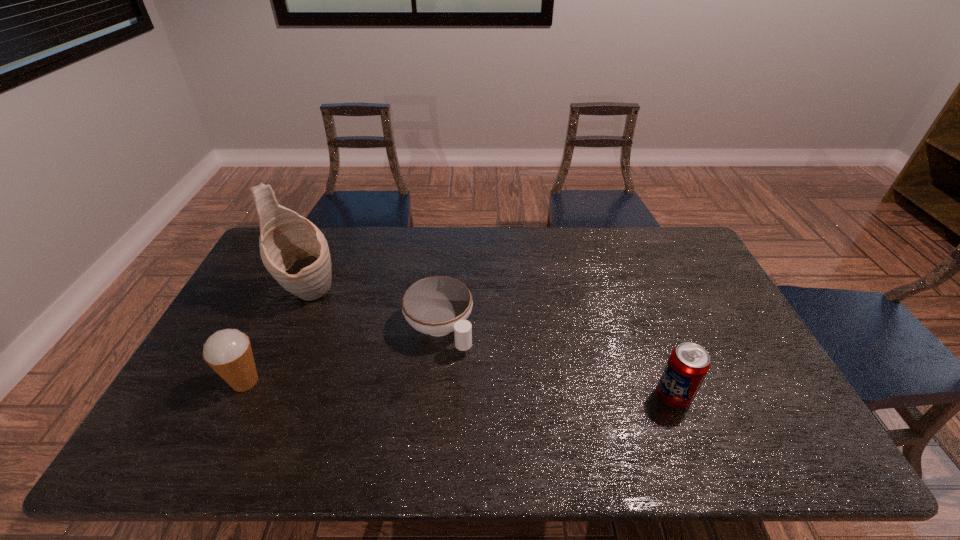
In the image, there is a desktop. Where is `vacant space at the right edge`? Image resolution: width=960 pixels, height=540 pixels. vacant space at the right edge is located at coordinates (728, 328).

Where is `free point between the rightmost object and the shortest object`? free point between the rightmost object and the shortest object is located at coordinates (556, 362).

You are a GUI agent. You are given a task and a screenshot of the screen. Output one action in this format:
    pyautogui.click(x=<x>, y=<y>)
    Task: Click on the vacant region between the icecream and the soda can
    The height and width of the screenshot is (540, 960).
    Given the screenshot: What is the action you would take?
    pyautogui.click(x=459, y=389)

You are a GUI agent. You are given a task and a screenshot of the screen. Output one action in this format:
    pyautogui.click(x=<x>, y=<y>)
    Task: Click on the free space that is in between the chinaware and the icecream
    The image size is (960, 540).
    Given the screenshot: What is the action you would take?
    pyautogui.click(x=342, y=355)

I want to click on free space between the chinaware and the tallest object, so click(373, 311).

Where is `free space between the shortest object and the pitcher`? free space between the shortest object and the pitcher is located at coordinates (373, 311).

The width and height of the screenshot is (960, 540). Identify the location of unoccupied position between the pitcher and the icecream. (276, 338).

The height and width of the screenshot is (540, 960). In order to click on vacant space that's between the rightmost object and the icecream in this screenshot , I will do `click(459, 389)`.

You are a GUI agent. You are given a task and a screenshot of the screen. Output one action in this format:
    pyautogui.click(x=<x>, y=<y>)
    Task: Click on the free space between the soda can and the icecream
    Image resolution: width=960 pixels, height=540 pixels.
    Given the screenshot: What is the action you would take?
    pyautogui.click(x=459, y=389)

The height and width of the screenshot is (540, 960). In order to click on empty space that is in between the icecream and the tallest object in this screenshot , I will do pos(276,338).